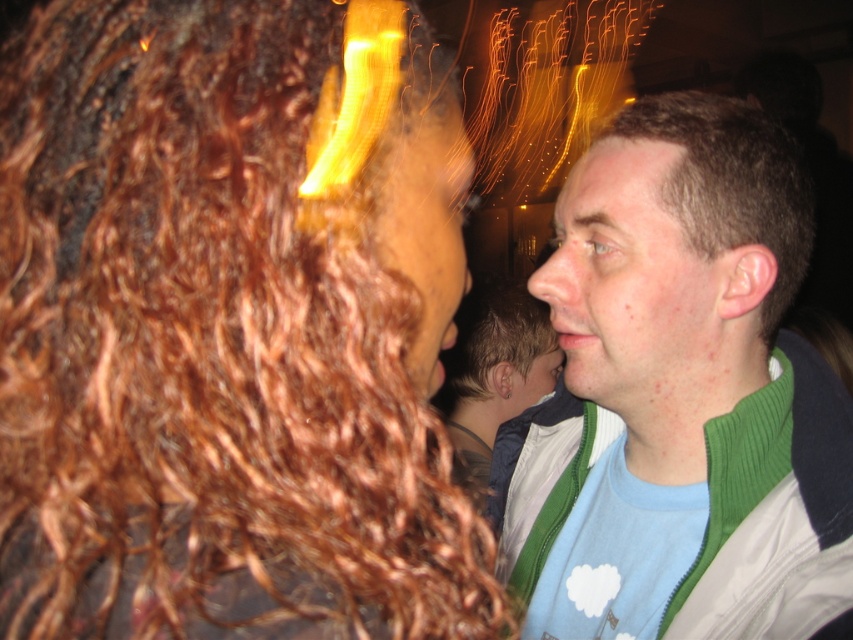
Is copper curly hair at left bigger than green corduroy jacket at right?

Incorrect, copper curly hair at left is not larger than green corduroy jacket at right.

Does copper curly hair at left appear on the right side of green corduroy jacket at right?

No, copper curly hair at left is not to the right of green corduroy jacket at right.

Image resolution: width=853 pixels, height=640 pixels. What do you see at coordinates (231, 326) in the screenshot?
I see `copper curly hair at left` at bounding box center [231, 326].

Locate an element on the screen. copper curly hair at left is located at coordinates (231, 326).

Is point (265, 596) positioned behind point (695, 141)?

No, (265, 596) is closer to viewer.

Is copper curly hair at left shorter than brown matte hair at right?

Incorrect, copper curly hair at left's height does not fall short of brown matte hair at right's.

This screenshot has height=640, width=853. I want to click on copper curly hair at left, so click(231, 326).

The height and width of the screenshot is (640, 853). Find the location of `copper curly hair at left`. copper curly hair at left is located at coordinates (231, 326).

I want to click on brown matte hair at right, so click(732, 182).

Is brown matte hair at right thinner than brown curly hair at center?

Yes.

Between point (735, 204) and point (498, 352), which one is positioned in front?

Point (735, 204) is more forward.

Find the location of `brown matte hair at right`. brown matte hair at right is located at coordinates (732, 182).